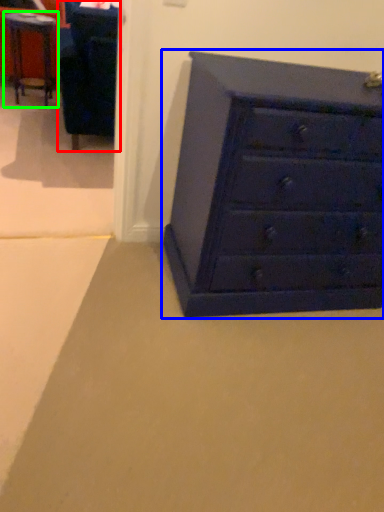
Question: Which object is the closest to the furniture (highlighted by a red box)? Choose among these: chest of drawers (highlighted by a blue box) or table (highlighted by a green box).

Choices:
 (A) chest of drawers
 (B) table

Answer: (B)